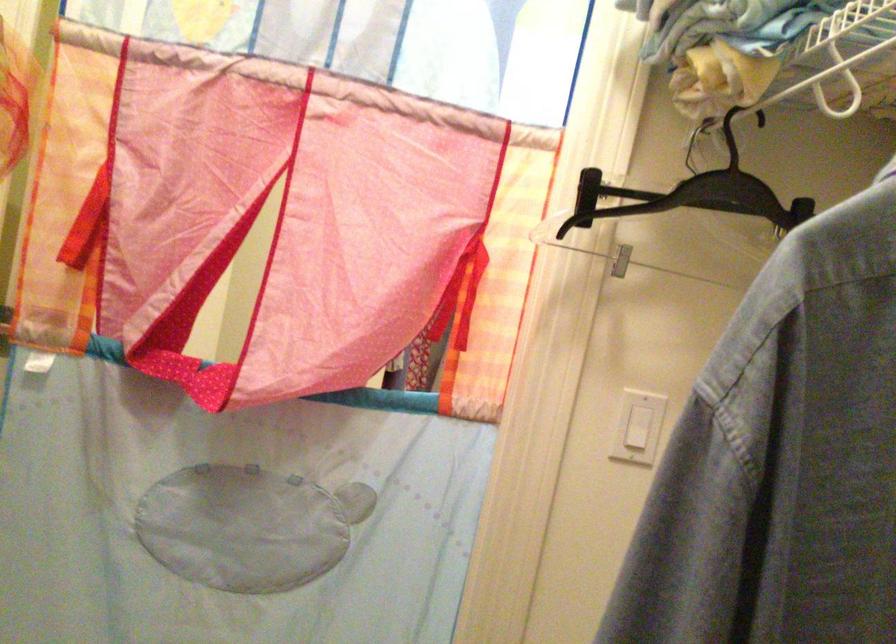
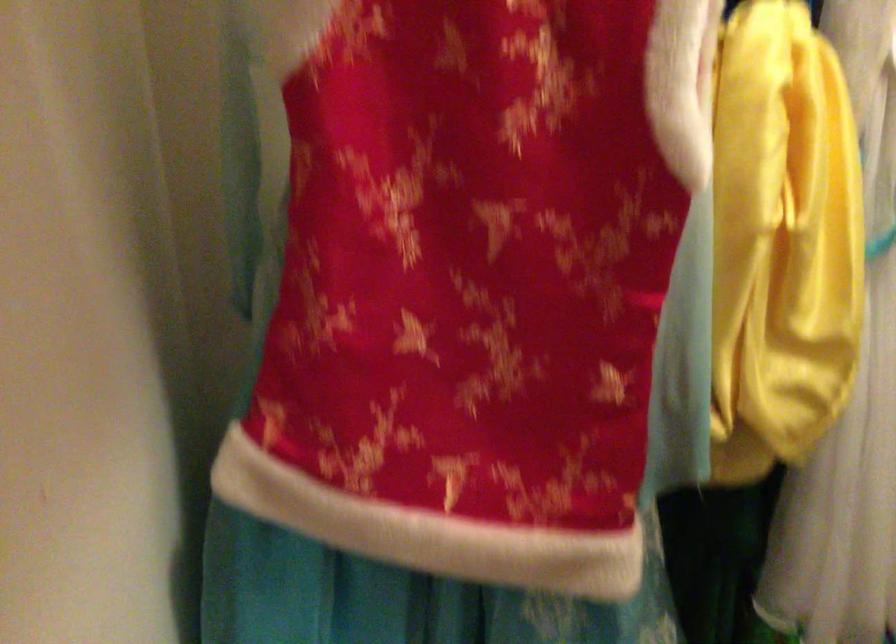
Question: The camera is either moving clockwise (left) or counter-clockwise (right) around the object. The first image is from the beginning of the video and the second image is from the end. Is the camera moving left or right when shooting the video?

Choices:
 (A) Left
 (B) Right

Answer: (B)